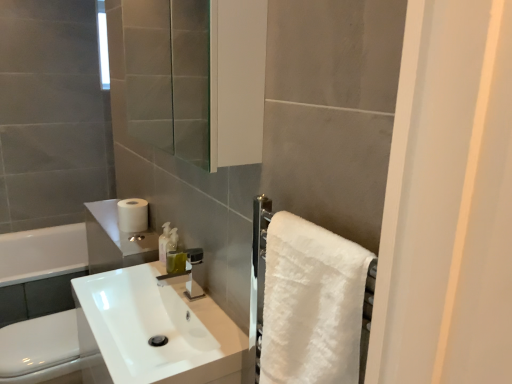
Find the location of `free location in front of white matte toilet paper at upper left`. free location in front of white matte toilet paper at upper left is located at coordinates (125, 238).